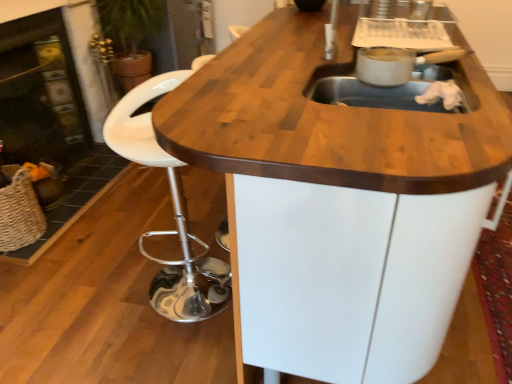
Find the location of a particular element. vacant space to the left of white plastic stool at lower left is located at coordinates (106, 294).